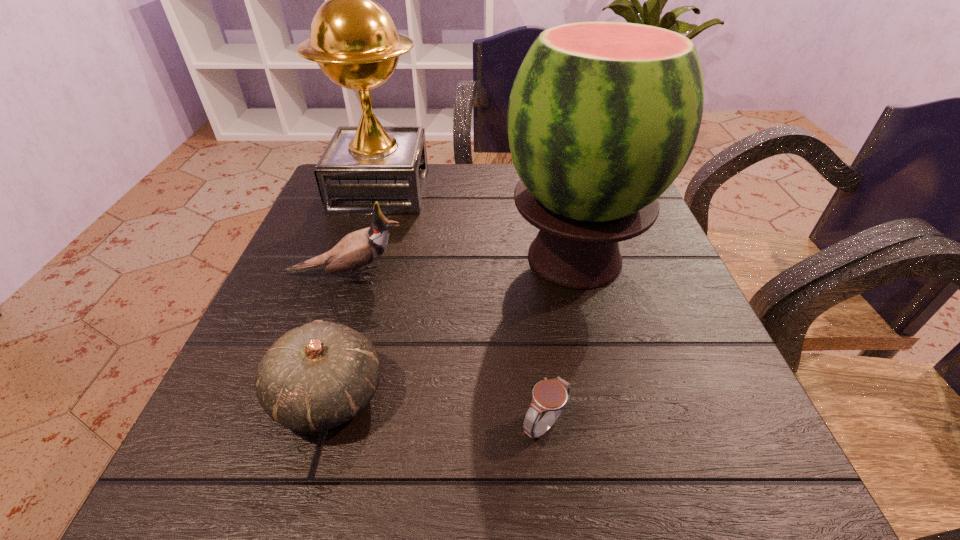
This screenshot has height=540, width=960. What are the coordinates of `object at the far edge` in the screenshot? It's located at (353, 39).

In order to click on gourd positioned at the near edge in this screenshot , I will do `click(316, 377)`.

Find the location of `watch that is at the near edge`. watch that is at the near edge is located at coordinates (551, 396).

This screenshot has height=540, width=960. In order to click on award present at the left edge in this screenshot , I will do `click(353, 39)`.

The image size is (960, 540). In order to click on bird located at the left edge in this screenshot , I will do `click(361, 248)`.

Identify the location of gourd positioned at the left edge. Image resolution: width=960 pixels, height=540 pixels. (316, 377).

Identify the location of object at the right edge. This screenshot has width=960, height=540. (602, 117).

What are the coordinates of `object that is at the far left corner` in the screenshot? It's located at (353, 39).

This screenshot has width=960, height=540. In order to click on object that is at the near left corner in this screenshot , I will do tap(316, 377).

Identify the location of free region at the far edge of the desktop. This screenshot has width=960, height=540. (455, 196).